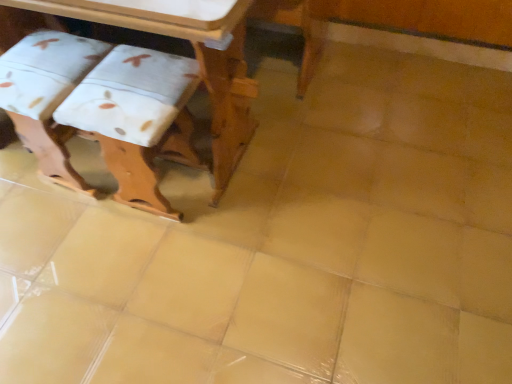
Question: In the image, is white fabric step stool at left, which is counted as the second step stool, starting from the left, on the left side or the right side of white fabric step stool at lower left, arranged as the 2th step stool when viewed from the right?

Choices:
 (A) left
 (B) right

Answer: (B)

Question: Which is correct: white fabric step stool at left, which is counted as the second step stool, starting from the left, is inside white fabric step stool at lower left, arranged as the 2th step stool when viewed from the right, or outside of it?

Choices:
 (A) outside
 (B) inside

Answer: (A)

Question: Based on their relative distances, which object is farther from the white fabric step stool at lower left, marked as the 1th step stool in a left-to-right arrangement?

Choices:
 (A) wooden table at upper left
 (B) white fabric step stool at left, which is counted as the second step stool, starting from the left

Answer: (A)

Question: Which object is the farthest from the white fabric step stool at lower left, marked as the 1th step stool in a left-to-right arrangement?

Choices:
 (A) wooden table at upper left
 (B) white fabric step stool at left, arranged as the 1th step stool when viewed from the right

Answer: (A)